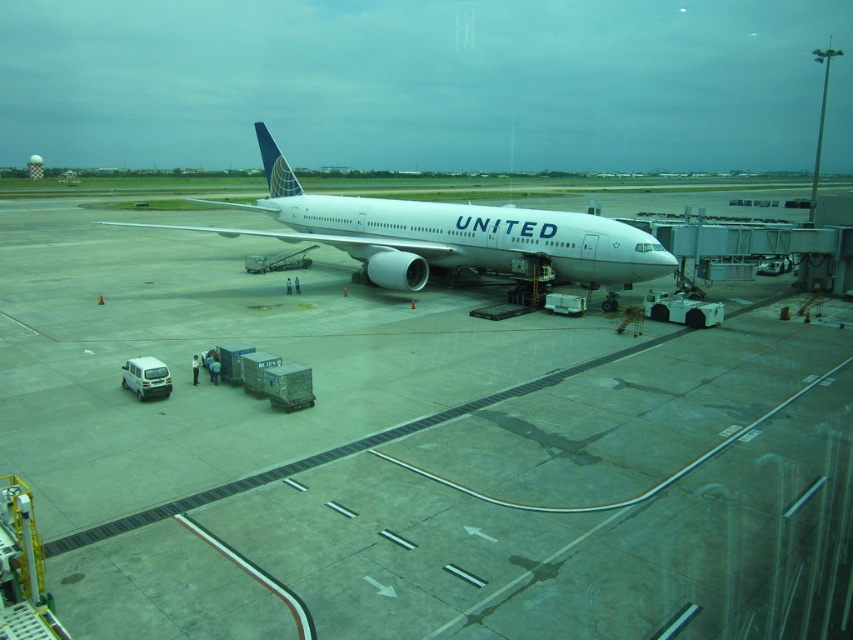
You are standing at the jet bridge looking out towards the aircraft. There are two points marked on the tarmac. The first point is at coordinate point (227, 550) and the second is at point (253, 125). Which point is closer to the aircraft?

Point (227, 550) is in front of point (253, 125), so it is closer to the aircraft.

You are standing at the jet bridge leading to the United Airlines aircraft. You want to walk to the white smooth tarmac at center. Which direction should you go relative to the jet bridge?

The white smooth tarmac at center is located at point coordinates of (412, 454). Since you are at the jet bridge, you should walk forward towards the aircraft to reach the white smooth tarmac at center.

You are a maintenance worker who needs to park a small van between the white smooth tarmac at center and the white glossy airplane at center. Can you fit the van there based on their sizes?

The white smooth tarmac at center is thinner than the white glossy airplane at center, so the space between them might be too narrow for the van to fit comfortably. Check the exact dimensions before attempting to park.